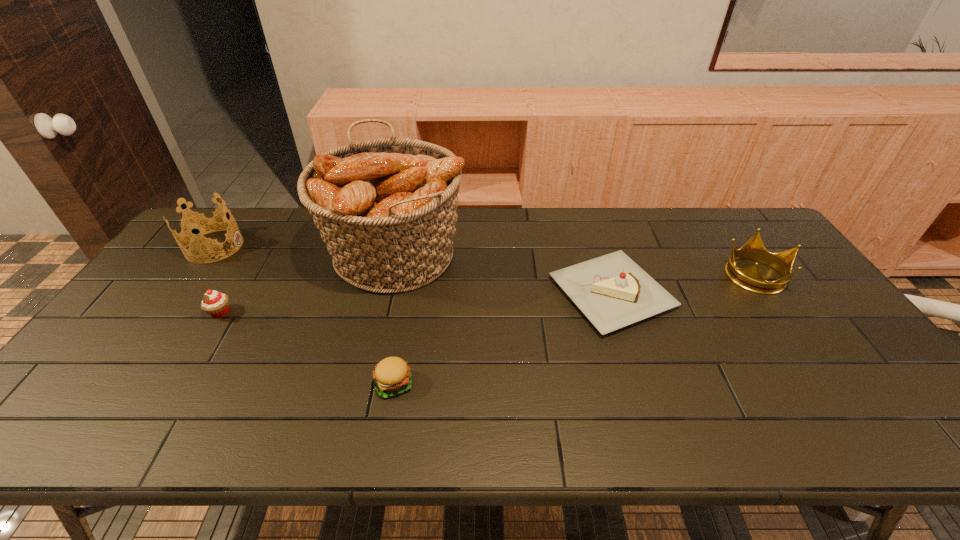
I want to click on vacant region at the far edge, so click(x=593, y=232).

Identify the location of vacant space at the near edge of the desktop. This screenshot has width=960, height=540. (841, 411).

This screenshot has width=960, height=540. In the image, there is a desktop. Identify the location of vacant area at the near right corner. (871, 438).

Locate an element on the screen. Image resolution: width=960 pixels, height=540 pixels. vacant space that is in between the shortest object and the taller crown is located at coordinates (303, 315).

Locate an element on the screen. vacant point located between the shortest object and the cupcake is located at coordinates (307, 348).

In order to click on vacant space in between the basket and the second tallest object in this screenshot , I will do `click(305, 249)`.

At what (x,y) coordinates should I click in order to perform the action: click on empty location between the cupcake and the second tallest object. Please return your answer as a coordinate pair (x, y). This screenshot has width=960, height=540. Looking at the image, I should click on (217, 279).

The width and height of the screenshot is (960, 540). Identify the location of vacant space in between the cake and the nearest object. (502, 338).

Locate an element on the screen. free space between the second object from left to right and the fifth object from left to right is located at coordinates (416, 303).

This screenshot has height=540, width=960. I want to click on vacant space that is in between the basket and the cake, so click(503, 273).